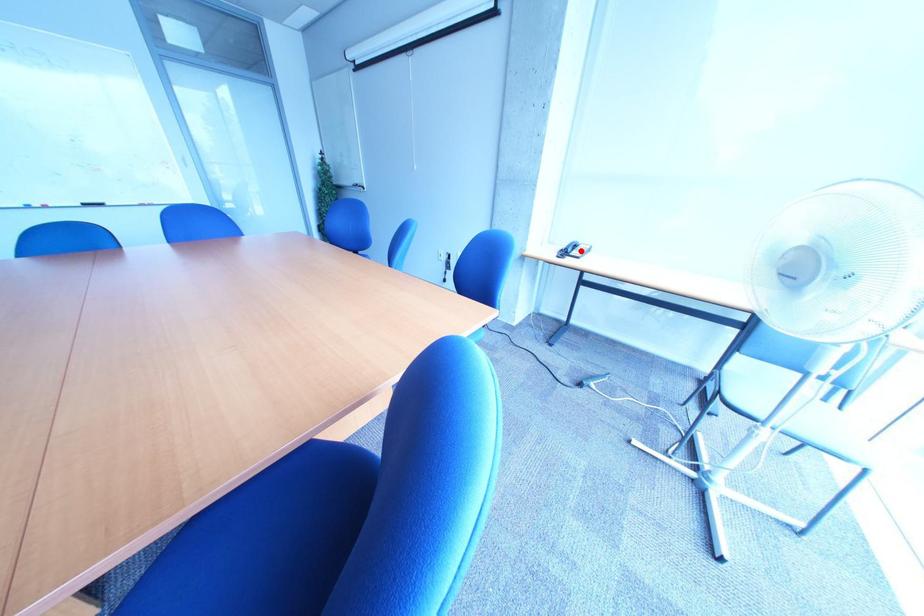
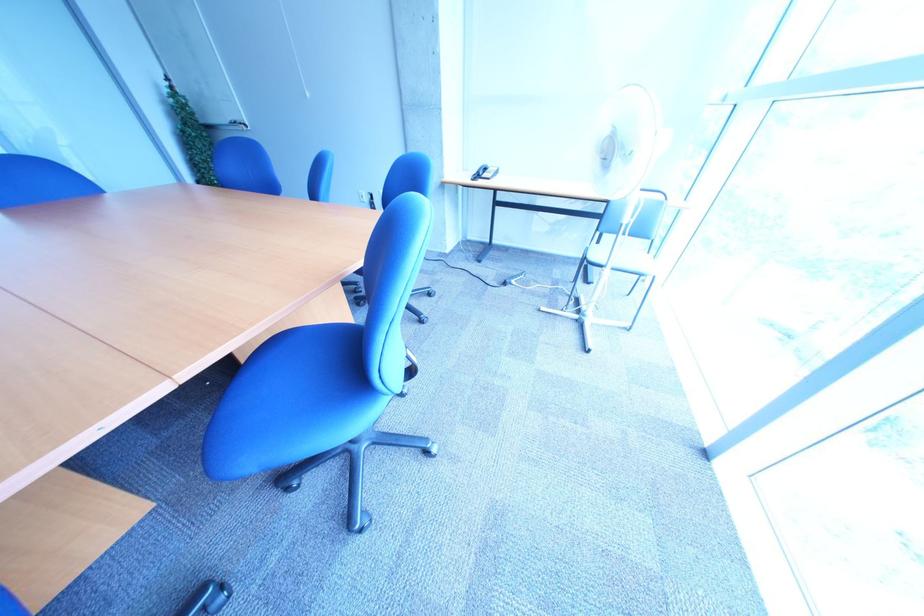
Question: I am providing you with two images of the same scene from different viewpoints. In image1, a red point is highlighted. Considering the same 3D point in image2, which of the following is correct?

Choices:
 (A) It is closer
 (B) It is farther

Answer: (A)